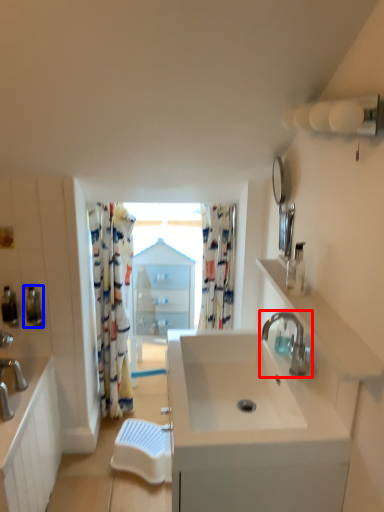
Question: Which point is further to the camera, tap (highlighted by a red box) or soap dispenser (highlighted by a blue box)?

Choices:
 (A) tap
 (B) soap dispenser

Answer: (B)